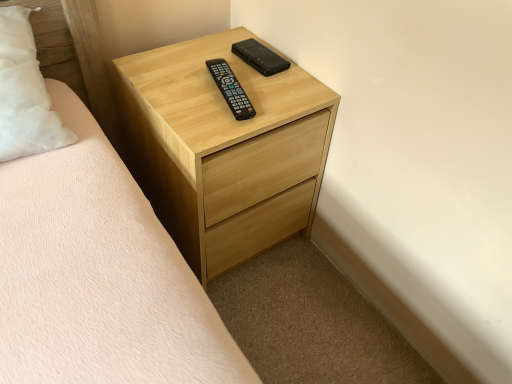
Question: Is black plastic remote at center, placed as the second control when sorted from back to front, wider than black matte phone at upper center, arranged as the second control when ordered from the bottom?

Choices:
 (A) no
 (B) yes

Answer: (B)

Question: From the image's perspective, is black plastic remote at center, placed as the second control when sorted from back to front, above black matte phone at upper center, the first control from the top?

Choices:
 (A) yes
 (B) no

Answer: (B)

Question: Could black matte phone at upper center, acting as the 1th control starting from the back, be considered to be inside black plastic remote at center, the first control from the front?

Choices:
 (A) no
 (B) yes

Answer: (A)

Question: From a real-world perspective, is black plastic remote at center, the first control in the bottom-to-top sequence, beneath black matte phone at upper center, which is the 2th control in front-to-back order?

Choices:
 (A) yes
 (B) no

Answer: (B)

Question: From the image's perspective, is black plastic remote at center, the first control in the bottom-to-top sequence, located beneath black matte phone at upper center, arranged as the second control when ordered from the bottom?

Choices:
 (A) no
 (B) yes

Answer: (B)

Question: Could you tell me if black plastic remote at center, the 2th control positioned from the top, is turned towards black matte phone at upper center, which is the 2th control in front-to-back order?

Choices:
 (A) yes
 (B) no

Answer: (B)

Question: Does light wood chest of drawers at center have a greater width compared to black matte phone at upper center, the first control from the top?

Choices:
 (A) no
 (B) yes

Answer: (B)

Question: Is light wood chest of drawers at center completely or partially outside of black matte phone at upper center, acting as the 1th control starting from the back?

Choices:
 (A) no
 (B) yes

Answer: (B)

Question: Is black matte phone at upper center, arranged as the second control when ordered from the bottom, at the back of light wood chest of drawers at center?

Choices:
 (A) yes
 (B) no

Answer: (B)

Question: Is light wood chest of drawers at center positioned behind black matte phone at upper center, which is the 2th control in front-to-back order?

Choices:
 (A) yes
 (B) no

Answer: (B)

Question: From a real-world perspective, is light wood chest of drawers at center under black matte phone at upper center, acting as the 1th control starting from the back?

Choices:
 (A) yes
 (B) no

Answer: (A)

Question: Is black matte phone at upper center, arranged as the second control when ordered from the bottom, inside light wood chest of drawers at center?

Choices:
 (A) yes
 (B) no

Answer: (A)

Question: Can you confirm if black matte phone at upper center, acting as the 1th control starting from the back, is taller than light wood chest of drawers at center?

Choices:
 (A) yes
 (B) no

Answer: (B)